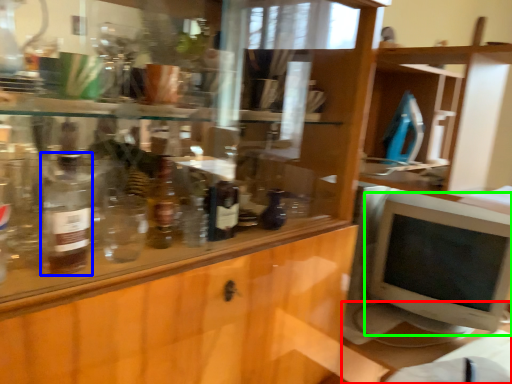
Question: Considering the real-world distances, which object is closest to table (highlighted by a red box)? bottle (highlighted by a blue box) or computer monitor (highlighted by a green box).

Choices:
 (A) bottle
 (B) computer monitor

Answer: (B)